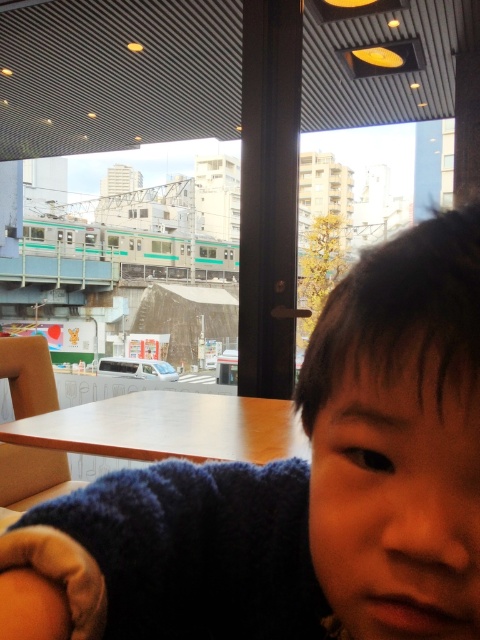
You are a customer sitting at the wooden table at center in the cafe. You want to place your large bag on the table without it hanging off the edge. Considering the space the dark blue sweater at center is taking up, do you think there is enough room for your bag?

The dark blue sweater at center occupies less space than wooden table at center, so there is enough room for your bag on the wooden table at center after accounting for the space taken by the dark blue sweater at center.

You are a customer sitting at the wooden table at center in the cafe. You want to see the train passing outside through the window. Can you see the train clearly over the dark blue sweater at center?

The dark blue sweater at center is much taller than the wooden table at center, so the sweater would block your view of the train outside.

You are a customer sitting at the wooden table at center in the cafe. You want to see the train passing outside through the large window. Is the dark blue sweater at center blocking your view of the window?

The dark blue sweater at center is located above the wooden table at center, so it is positioned above you and would not block your view of the window.